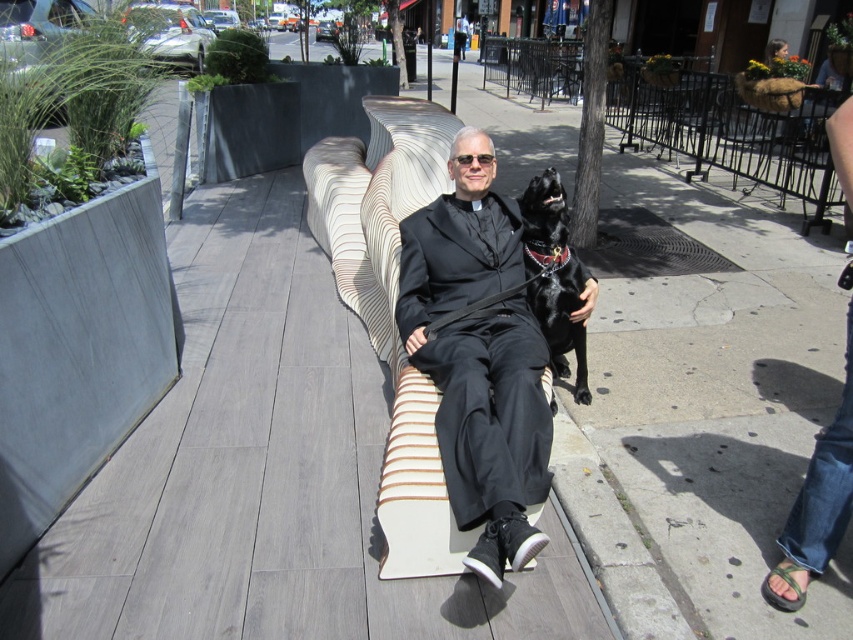
Which is above, black matte suit at center or black leather dog at center?

black leather dog at center is above.

Who is more forward, (x=505, y=424) or (x=529, y=289)?

Point (x=505, y=424) is more forward.

Find the location of a particular element. This screenshot has width=853, height=640. black matte suit at center is located at coordinates (479, 356).

Where is `black matte suit at center`? The width and height of the screenshot is (853, 640). black matte suit at center is located at coordinates (479, 356).